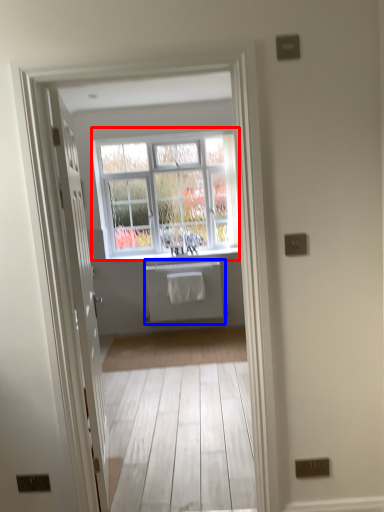
Question: Among these objects, which one is farthest to the camera, window (highlighted by a red box) or appliance (highlighted by a blue box)?

Choices:
 (A) window
 (B) appliance

Answer: (B)